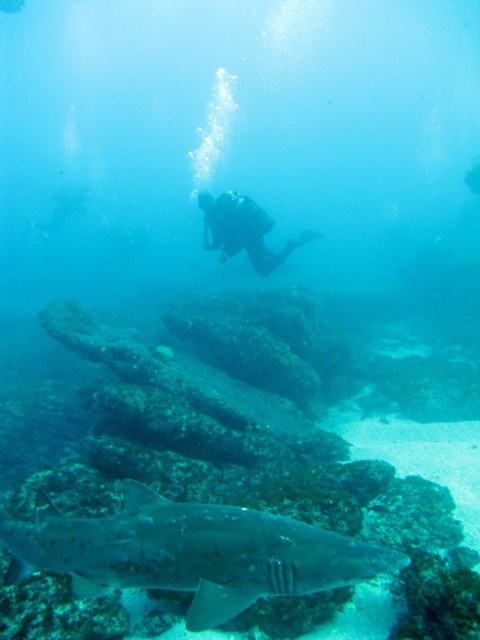
Question: Does gray textured shark at lower center have a larger size compared to black rubber scuba diver at center?

Choices:
 (A) yes
 (B) no

Answer: (B)

Question: Does gray textured shark at lower center have a larger size compared to black rubber scuba diver at center?

Choices:
 (A) no
 (B) yes

Answer: (A)

Question: Which point is closer to the camera taking this photo?

Choices:
 (A) (207, 200)
 (B) (204, 518)

Answer: (B)

Question: Which point is closer to the camera?

Choices:
 (A) gray textured shark at lower center
 (B) black rubber scuba diver at center

Answer: (A)

Question: Can you confirm if gray textured shark at lower center is positioned below black rubber scuba diver at center?

Choices:
 (A) yes
 (B) no

Answer: (A)

Question: Which point is farther to the camera?

Choices:
 (A) black rubber scuba diver at center
 (B) gray textured shark at lower center

Answer: (A)